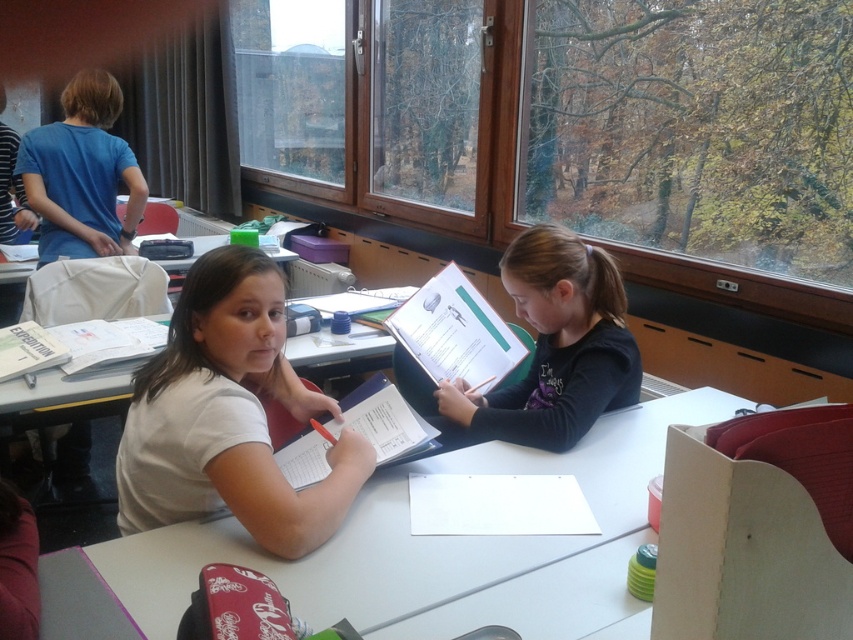
Can you confirm if white plastic table at center is smaller than blue cotton shirt at upper left?

No.

Looking at this image, is white plastic table at center taller than blue cotton shirt at upper left?

No, white plastic table at center is not taller than blue cotton shirt at upper left.

Who is more forward, (532,561) or (136,184)?

Point (532,561) is more forward.

The width and height of the screenshot is (853, 640). In order to click on white plastic table at center in this screenshot , I will do click(x=374, y=540).

Which of these two, white matte shirt at center or blue cotton shirt at upper left, stands shorter?

Standing shorter between the two is white matte shirt at center.

Is point (347, 493) more distant than point (67, 189)?

No.

Is point (193, 419) farther from viewer compared to point (138, 193)?

No, (193, 419) is closer to viewer.

Where is `white matte shirt at center`? white matte shirt at center is located at coordinates (228, 417).

How much distance is there between white plastic table at center and matte blue binder at center?

white plastic table at center and matte blue binder at center are 23.03 inches apart.

What do you see at coordinates (374, 540) in the screenshot?
I see `white plastic table at center` at bounding box center [374, 540].

Identify the location of white plastic table at center. (374, 540).